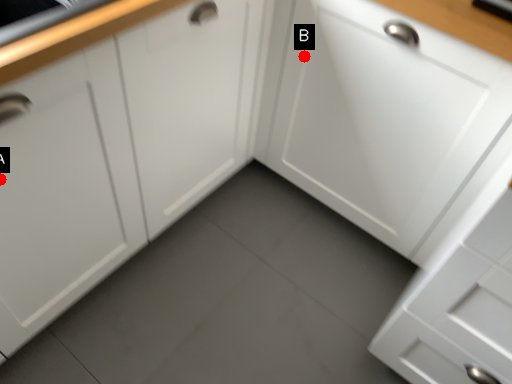
Question: Two points are circled on the image, labeled by A and B beside each circle. Which point is further to the camera?

Choices:
 (A) A is further
 (B) B is further

Answer: (B)